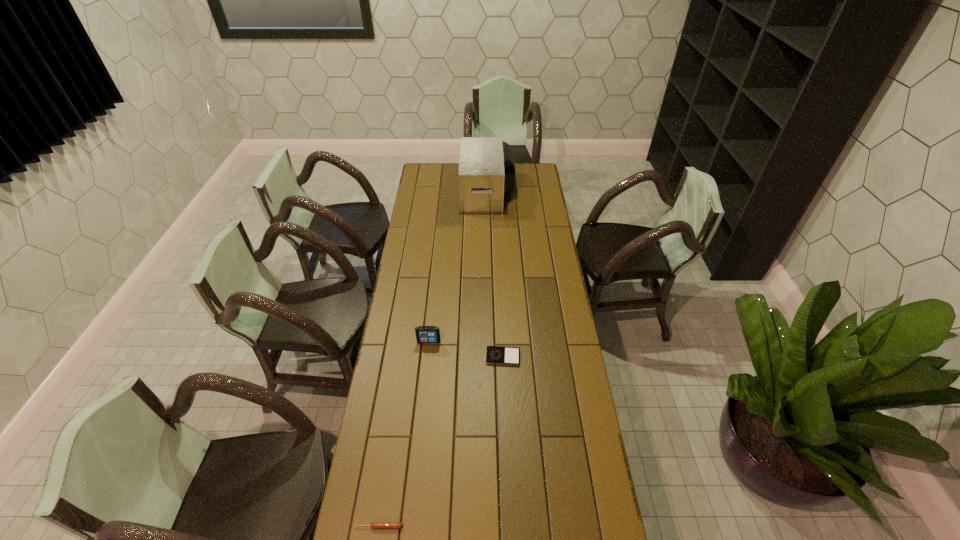
Where is `free space at the far right corner`? free space at the far right corner is located at coordinates (539, 177).

Find the location of a particular element. This screenshot has height=540, width=960. free point between the sausage and the nearer iPod is located at coordinates (441, 442).

What are the coordinates of `free space between the shorter iPod and the farthest object` in the screenshot? It's located at (495, 274).

Locate an element on the screen. This screenshot has height=540, width=960. free spot between the farthest object and the sausage is located at coordinates [433, 359].

Locate an element on the screen. The width and height of the screenshot is (960, 540). free space between the shorter iPod and the third tallest object is located at coordinates (441, 442).

Identify the location of empty location between the sausage and the tallest object. This screenshot has width=960, height=540. (433, 359).

I want to click on vacant area that lies between the shorter iPod and the farther iPod, so click(466, 349).

Identify the location of vacant space in between the right iPod and the microwave oven. (495, 274).

Find the location of a particular element. This screenshot has height=540, width=960. blank region between the farther iPod and the microwave oven is located at coordinates (458, 267).

Identify the location of free space that is in between the nearer iPod and the farther iPod. (466, 349).